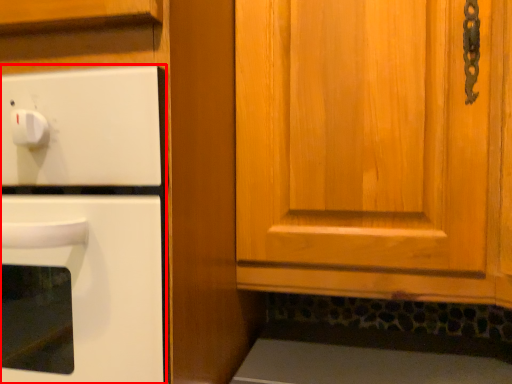
Question: From the image, what is the correct spatial relationship of oven (annotated by the red box) in relation to cabinetry?

Choices:
 (A) right
 (B) left

Answer: (B)